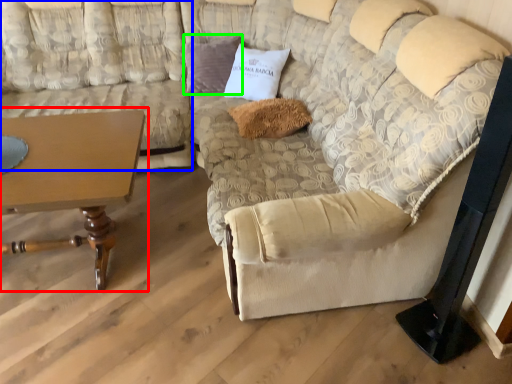
Question: Based on their relative distances, which object is farther from table (highlighted by a red box)? Choose from couch (highlighted by a blue box) and pillow (highlighted by a green box).

Choices:
 (A) couch
 (B) pillow

Answer: (B)